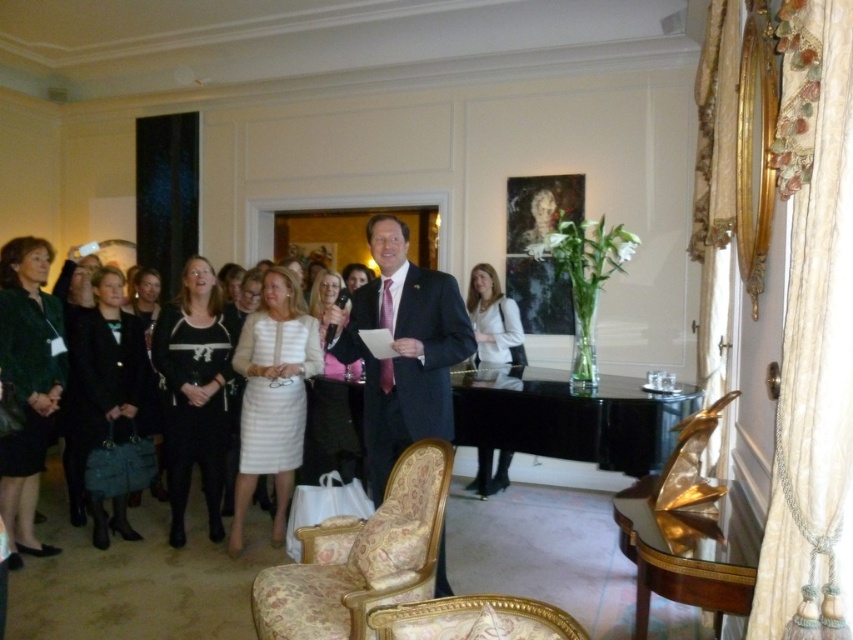
Who is positioned more to the left, matte black suit at center or gold-patterned fabric armchair at lower center?

matte black suit at center

Is matte black suit at center further to camera compared to gold-patterned fabric armchair at lower center?

Yes, matte black suit at center is behind gold-patterned fabric armchair at lower center.

Where is `matte black suit at center`? Image resolution: width=853 pixels, height=640 pixels. matte black suit at center is located at coordinates (402, 349).

Between black satin dress at center and white striped dress at center, which one appears on the right side from the viewer's perspective?

Positioned to the right is white striped dress at center.

Is black satin dress at center closer to the viewer compared to white striped dress at center?

That is False.

Between point (164, 323) and point (289, 403), which one is positioned behind?

The point (164, 323) is more distant.

The image size is (853, 640). Identify the location of black satin dress at center. (193, 394).

Between floral-patterned fabric armchair at center and black satin dress at center, which one appears on the right side from the viewer's perspective?

From the viewer's perspective, floral-patterned fabric armchair at center appears more on the right side.

Does floral-patterned fabric armchair at center come in front of black satin dress at center?

Yes.

The height and width of the screenshot is (640, 853). Identify the location of floral-patterned fabric armchair at center. (361, 557).